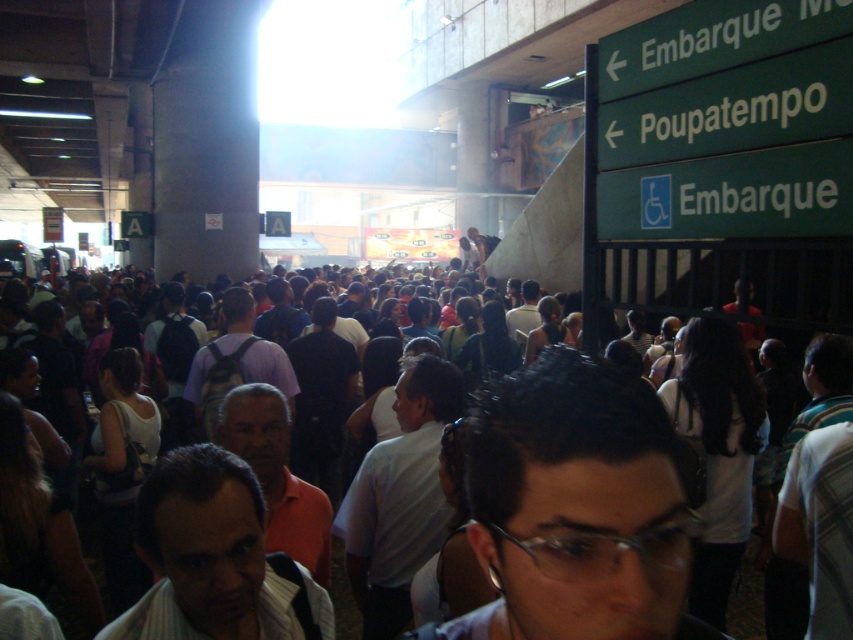
You are a photographer standing in the crowd at the station. You want to take a picture of the dark hair at center and the white matte shirt at center. Which one should you focus on first to ensure both are in the frame?

Since the dark hair at center is above the white matte shirt at center, you should focus on the dark hair at center first to ensure both are in the frame.

You are standing in the station and see a person with dark hair at center and a white matte shirt at center. Which one is positioned more to the right?

The dark hair at center is positioned to the right of the white matte shirt at center, so the dark hair at center is more to the right.

You are standing in the transportation hub and want to quickly reach the exit, which is located behind the dark clothing crowd at center. Given that the crowd is 2.62 meters away from you, can you estimate how many steps it would take to reach them if each of your steps is 0.75 meters long?

The dark clothing crowd at center is 2.62 meters away from the viewer. Since each step is 0.75 meters long, dividing 2.62 by 0.75 gives approximately 3.5 steps. Therefore, it would take about 4 steps to reach the dark clothing crowd at center.